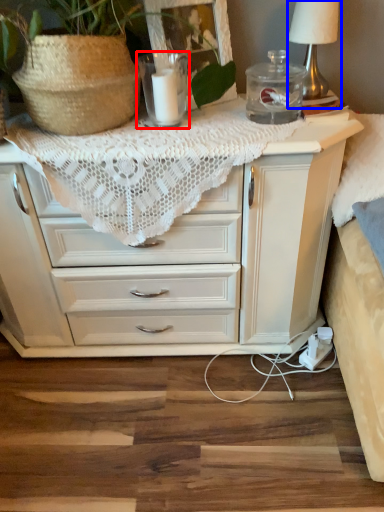
Question: Which point is further to the camera, candle holder (highlighted by a red box) or table lamp (highlighted by a blue box)?

Choices:
 (A) candle holder
 (B) table lamp

Answer: (B)